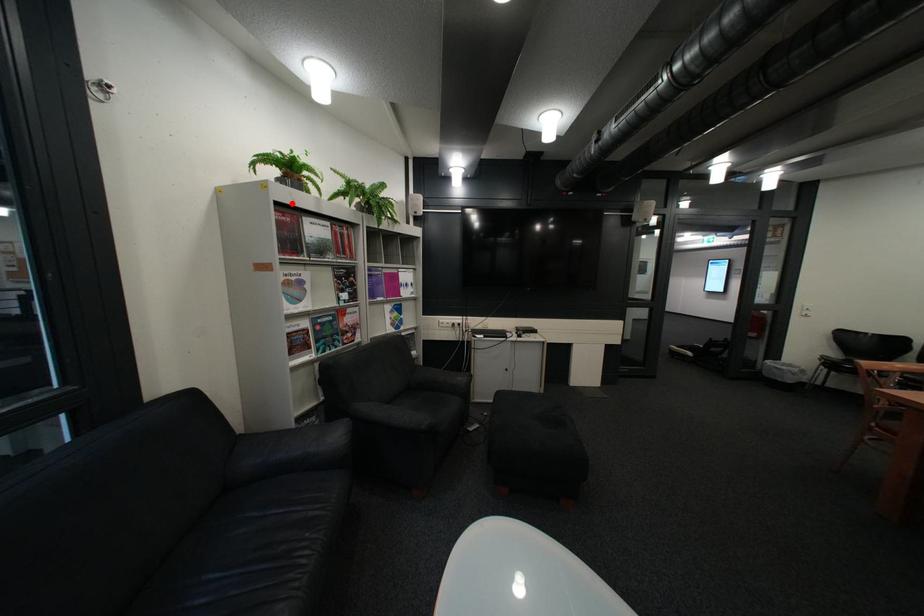
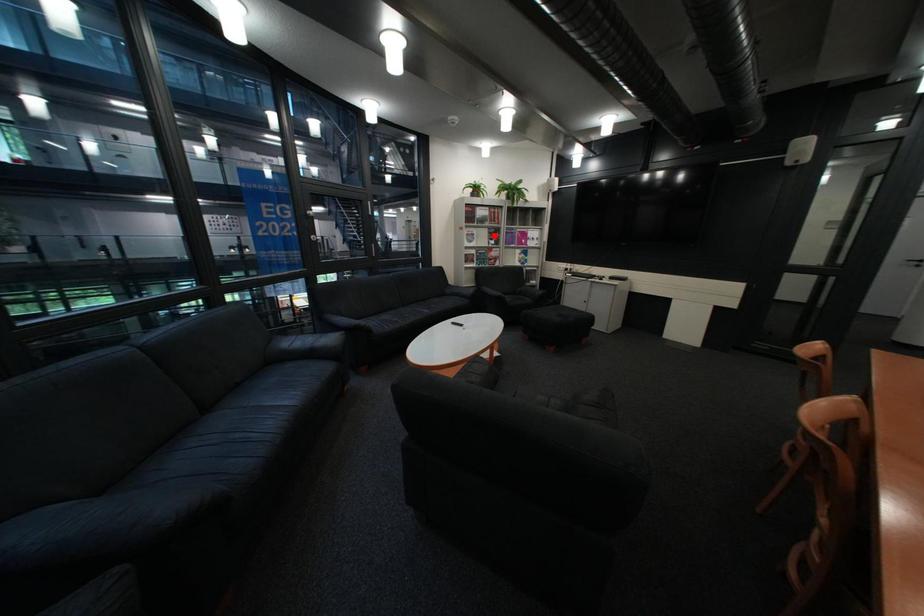
I am providing you with two images of the same scene from different viewpoints. A red point is marked on the first image and another point is marked on the second image. Is the red point in image1 aligned with the point shown in image2?

No